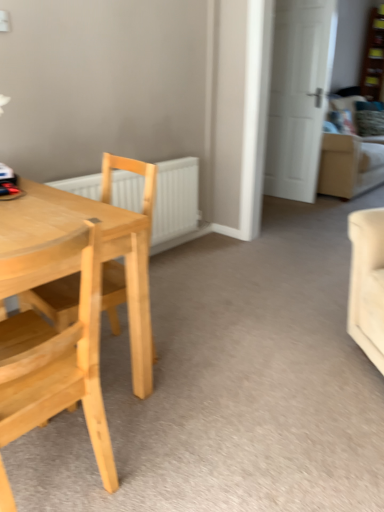
Question: Is white matte radiator at center further to camera compared to light wood chair at left, the second chair viewed from the back?

Choices:
 (A) yes
 (B) no

Answer: (A)

Question: Is white matte radiator at center bigger than light wood chair at left, the 1th chair from the front?

Choices:
 (A) no
 (B) yes

Answer: (A)

Question: Is white matte radiator at center completely or partially outside of light wood chair at left, the second chair viewed from the back?

Choices:
 (A) yes
 (B) no

Answer: (A)

Question: Is white matte radiator at center turned away from light wood chair at left, the second chair viewed from the back?

Choices:
 (A) yes
 (B) no

Answer: (B)

Question: Could light wood chair at left, the second chair viewed from the back, be considered to be inside white matte radiator at center?

Choices:
 (A) no
 (B) yes

Answer: (A)

Question: Is white matte radiator at center at the right side of light wood chair at left, the second chair viewed from the back?

Choices:
 (A) no
 (B) yes

Answer: (B)

Question: Can you confirm if beige fabric couch at upper right is bigger than light wood chair at left, the 1th chair from the front?

Choices:
 (A) yes
 (B) no

Answer: (A)

Question: Can you confirm if beige fabric couch at upper right is smaller than light wood chair at left, the 1th chair from the front?

Choices:
 (A) no
 (B) yes

Answer: (A)

Question: Does beige fabric couch at upper right have a greater height compared to light wood chair at left, the 1th chair from the front?

Choices:
 (A) no
 (B) yes

Answer: (A)

Question: From a real-world perspective, is beige fabric couch at upper right positioned under light wood chair at left, the 1th chair from the front, based on gravity?

Choices:
 (A) yes
 (B) no

Answer: (B)

Question: Considering the relative positions of beige fabric couch at upper right and light wood chair at left, the second chair viewed from the back, in the image provided, is beige fabric couch at upper right in front of light wood chair at left, the second chair viewed from the back,?

Choices:
 (A) no
 (B) yes

Answer: (A)

Question: Is beige fabric couch at upper right oriented towards light wood chair at left, the second chair viewed from the back?

Choices:
 (A) yes
 (B) no

Answer: (B)

Question: Can you see wooden bookshelf at upper right touching light wood chair at left, the 1th chair from the front?

Choices:
 (A) no
 (B) yes

Answer: (A)